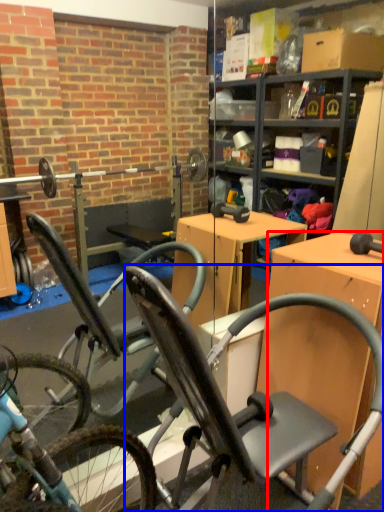
Question: Which object appears closest to the camera in this image, desk (highlighted by a red box) or chair (highlighted by a blue box)?

Choices:
 (A) desk
 (B) chair

Answer: (B)